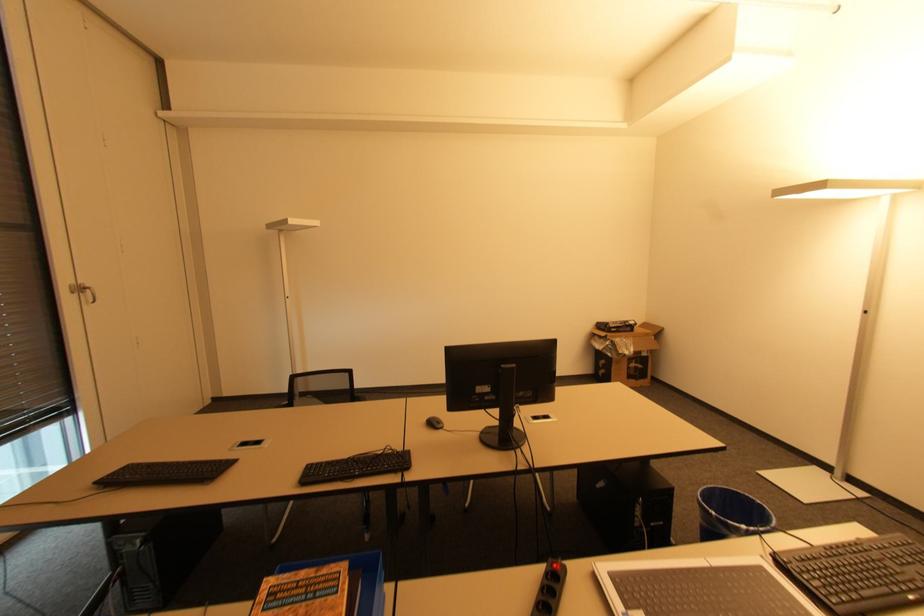
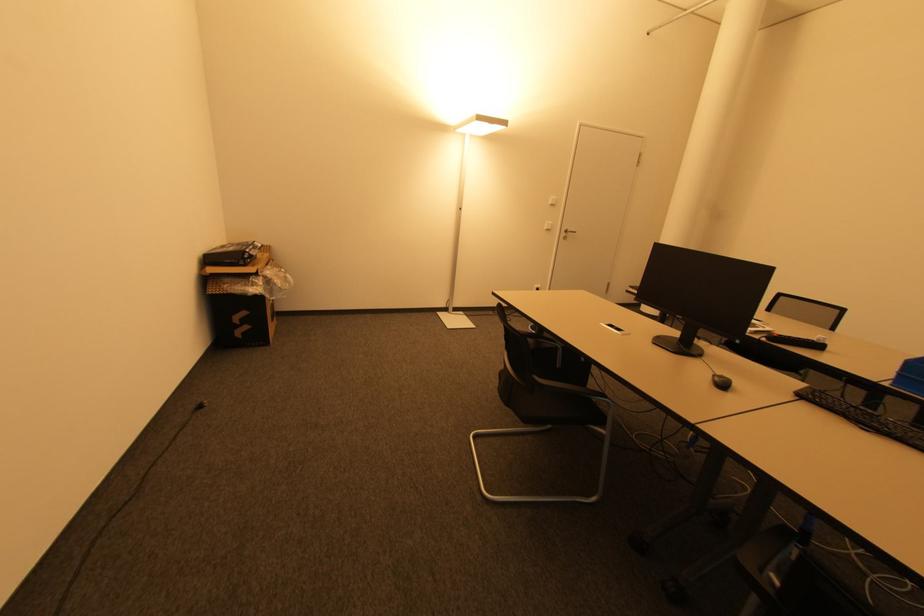
Where in the second image is the point corresponding to pixel 434 424 from the first image?

(725, 386)